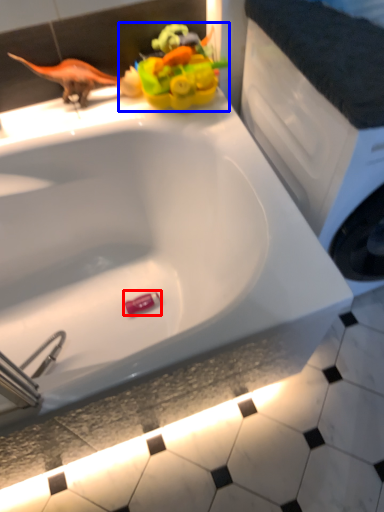
Question: Which object is further to the camera taking this photo, toy (highlighted by a red box) or toy (highlighted by a blue box)?

Choices:
 (A) toy
 (B) toy

Answer: (A)